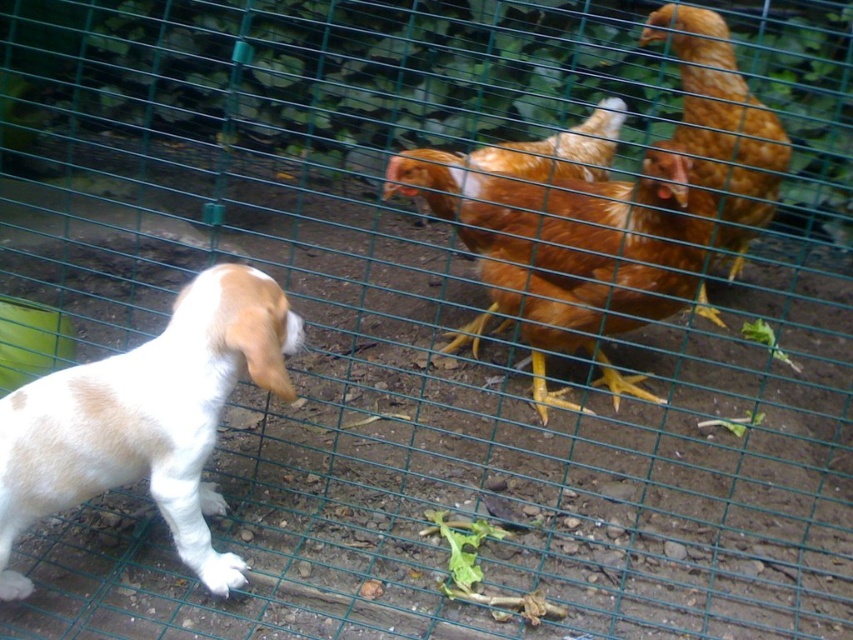
Question: Does white fur dog at left have a greater width compared to golden brown feathers at center?

Choices:
 (A) yes
 (B) no

Answer: (B)

Question: Is white fur dog at left above golden feathered chicken at upper right?

Choices:
 (A) no
 (B) yes

Answer: (A)

Question: Which of the following is the farthest from the observer?

Choices:
 (A) white fur dog at left
 (B) golden brown feathers at center

Answer: (B)

Question: Estimate the real-world distances between objects in this image. Which object is closer to the golden feathered chicken at upper right?

Choices:
 (A) golden brown feathers at center
 (B) white fur dog at left

Answer: (A)

Question: Which object appears closest to the camera in this image?

Choices:
 (A) white fur dog at left
 (B) golden feathered chicken at upper right

Answer: (A)

Question: Can you confirm if white fur dog at left is smaller than golden feathered chicken at upper right?

Choices:
 (A) yes
 (B) no

Answer: (A)